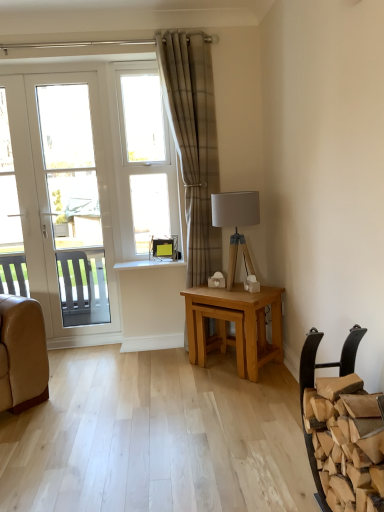
This screenshot has width=384, height=512. What are the coordinates of `free space to the left of plaid fabric curtain at center` in the screenshot? It's located at (169, 354).